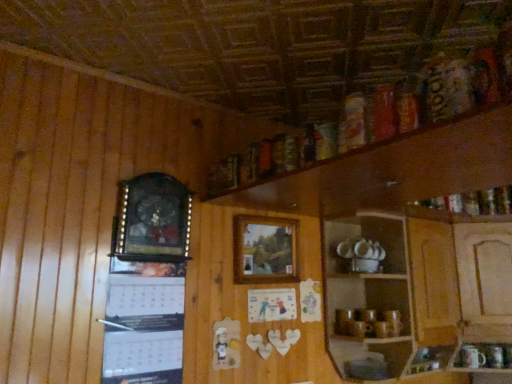
Question: In terms of size, does wooden picture frame at center, the 2th picture frame in the left-to-right sequence, appear bigger or smaller than wooden cabinet at lower right?

Choices:
 (A) big
 (B) small

Answer: (B)

Question: Would you say wooden picture frame at center, marked as the 1th picture frame in a right-to-left arrangement, is to the left or to the right of wooden cabinet at lower right in the picture?

Choices:
 (A) left
 (B) right

Answer: (A)

Question: Which object is the closest to the white paper calendar at upper left?

Choices:
 (A) wooden picture frame at left, the 2th picture frame viewed from the back
 (B) wooden picture frame at center, the 1th picture frame when ordered from back to front
 (C) wooden cabinet at lower right

Answer: (A)

Question: Based on their relative distances, which object is farther from the wooden picture frame at center, the 1th picture frame when ordered from back to front?

Choices:
 (A) wooden cabinet at lower right
 (B) white paper calendar at upper left
 (C) wooden picture frame at left, which appears as the second picture frame when viewed from the right

Answer: (B)